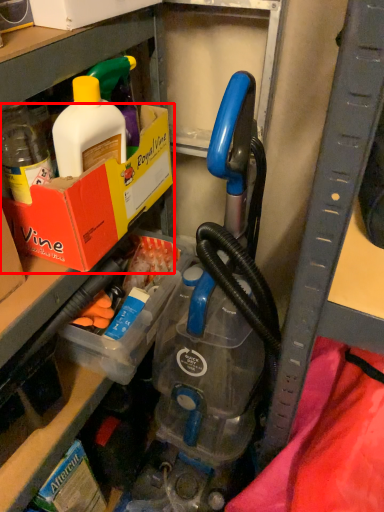
Question: From the image's perspective, what is the correct spatial positioning of box (annotated by the red box) in reference to storage box?

Choices:
 (A) below
 (B) above

Answer: (B)